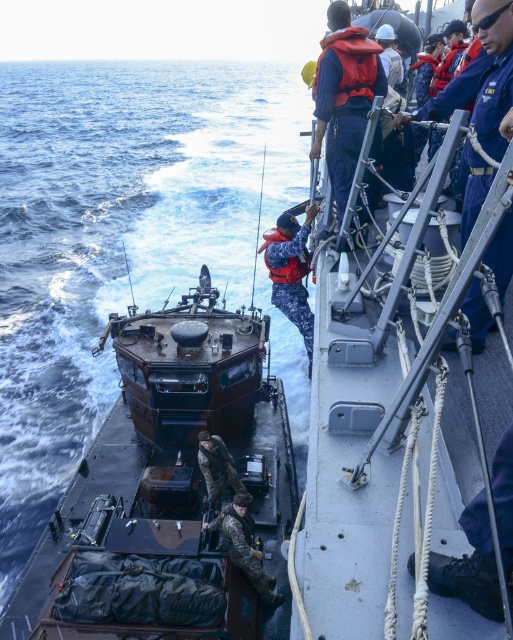
Question: Considering the relative positions of brown matte boat at center and camouflage fabric soldier at center in the image provided, where is brown matte boat at center located with respect to camouflage fabric soldier at center?

Choices:
 (A) left
 (B) right

Answer: (B)

Question: Which of the following is the closest to the observer?

Choices:
 (A) (367, 81)
 (B) (81, 509)
 (C) (448, 77)
 (D) (230, 536)

Answer: (D)

Question: Can you confirm if camouflage fabric uniform at center is wider than camouflage fabric soldier at center?

Choices:
 (A) yes
 (B) no

Answer: (A)

Question: Is camouflage fabric uniform at center wider than red nylon life jacket at center?

Choices:
 (A) no
 (B) yes

Answer: (B)

Question: Which object is the farthest from the orange life jacket at upper center?

Choices:
 (A) red nylon life jacket at center
 (B) brown matte boat at center

Answer: (B)

Question: Which object is positioned farthest from the red nylon life jacket at center?

Choices:
 (A) brown matte boat at center
 (B) camouflage pants at center

Answer: (A)